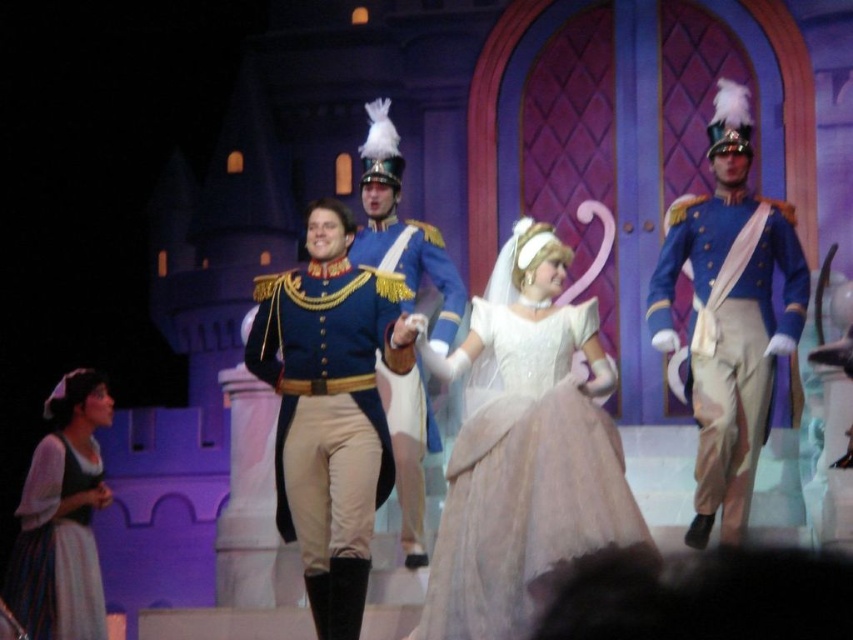
Question: Which object is farther from the camera taking this photo?

Choices:
 (A) matte blue uniform at right
 (B) blue satin jacket at center

Answer: (A)

Question: Is matte blue uniform at right smaller than white cotton dress at lower left?

Choices:
 (A) yes
 (B) no

Answer: (A)

Question: Estimate the real-world distances between objects in this image. Which object is closer to the blue satin jacket at center?

Choices:
 (A) blue satin uniform at center
 (B) matte blue uniform at right
 (C) white satin dress at center
 (D) white cotton dress at lower left

Answer: (C)

Question: Which point is farther from the camera taking this photo?

Choices:
 (A) (509, 580)
 (B) (76, 444)

Answer: (B)

Question: Is blue satin jacket at center wider than matte blue uniform at right?

Choices:
 (A) no
 (B) yes

Answer: (A)

Question: In this image, where is white satin dress at center located relative to white cotton dress at lower left?

Choices:
 (A) below
 (B) above

Answer: (B)